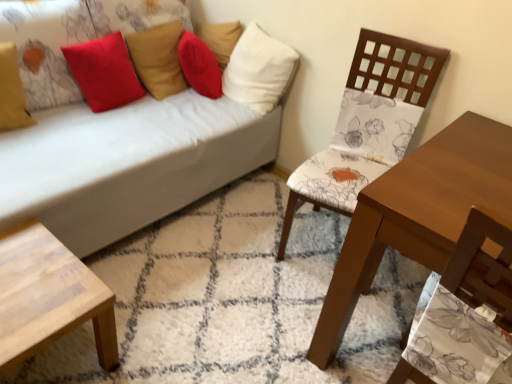
Identify the location of vacant space to the right of light wood/texture coffee table at lower left. (161, 335).